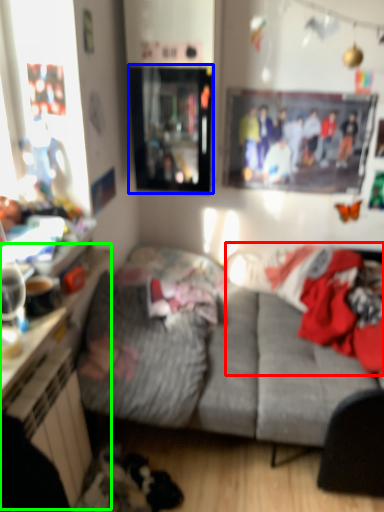
Question: Which object is positioned closest to laundry (highlighted by a red box)? Select from window screen (highlighted by a blue box) and dresser (highlighted by a green box).

Choices:
 (A) window screen
 (B) dresser

Answer: (A)